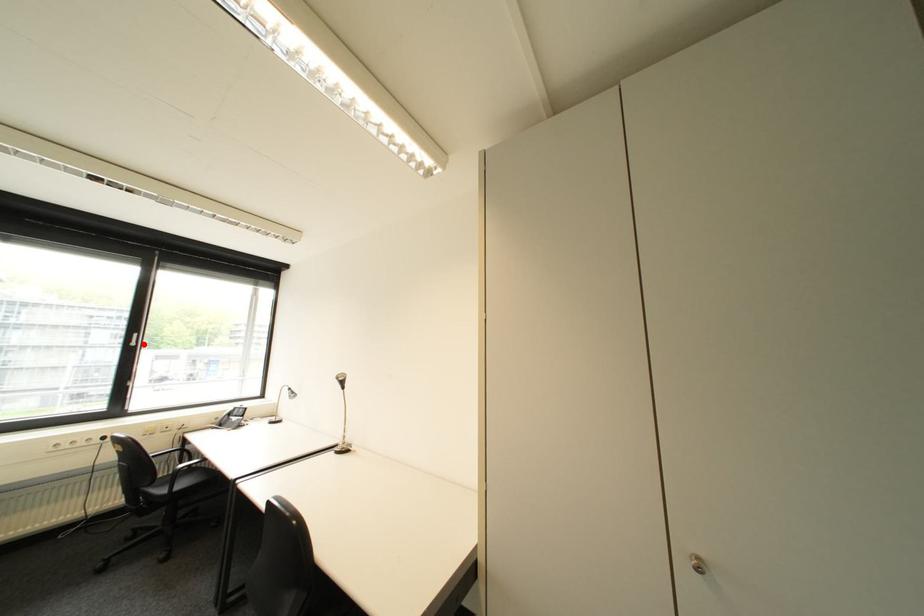
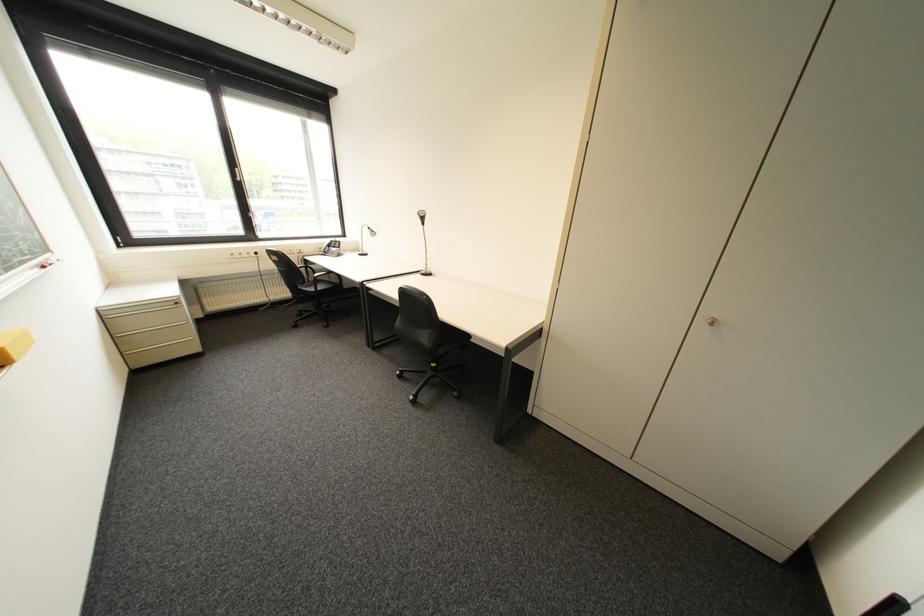
The point at the highlighted location is marked in the first image. Where is the corresponding point in the second image?

(249, 180)